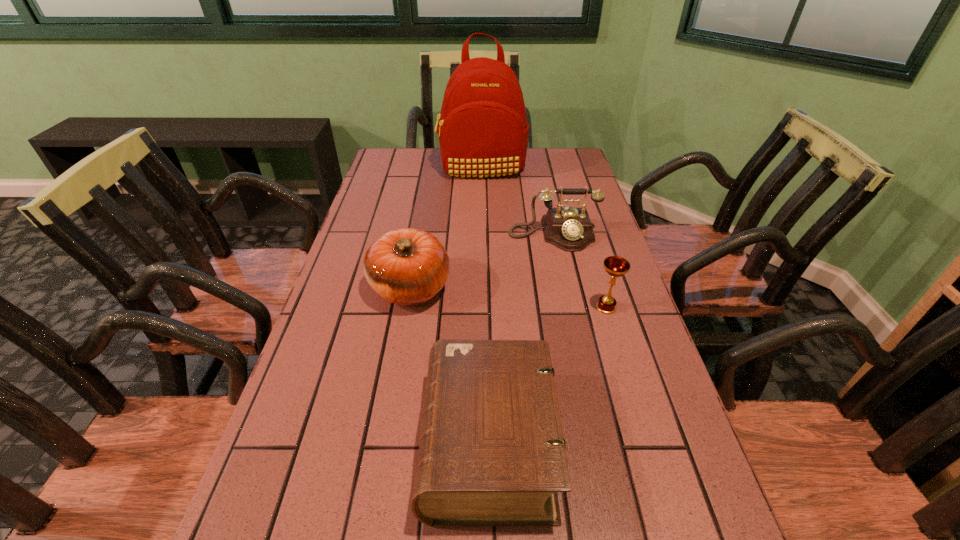
Find the location of a particular element. This screenshot has width=960, height=540. vacant position in the image that satisfies the following two spatial constraints: 1. on the dial of the second farthest object; 2. on the spine side of the nearest object is located at coordinates (598, 442).

Locate an element on the screen. The width and height of the screenshot is (960, 540). vacant space that satisfies the following two spatial constraints: 1. on the front side of the chalice; 2. on the spine side of the Bible is located at coordinates (647, 442).

In order to click on vacant space that satisfies the following two spatial constraints: 1. on the dial of the chalice; 2. on the right side of the telephone in this screenshot , I will do `click(569, 308)`.

What are the coordinates of `vacant space that satisfies the following two spatial constraints: 1. on the front-facing side of the tallest object; 2. on the left side of the chalice` in the screenshot? It's located at (483, 308).

Find the location of a particular element. free location that satisfies the following two spatial constraints: 1. on the dial of the telephone; 2. on the left side of the chalice is located at coordinates (569, 308).